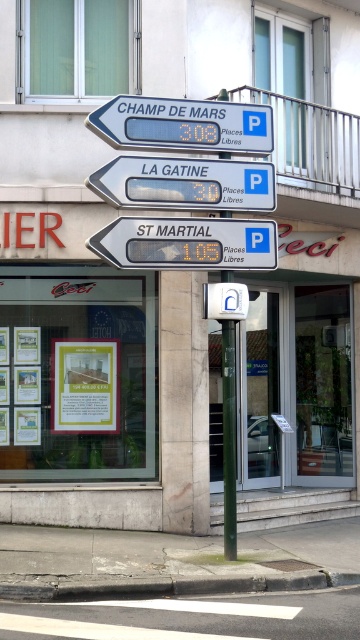
Question: Which of the following is the farthest from the observer?

Choices:
 (A) green metallic pole at center
 (B) matte gray sign at center

Answer: (A)

Question: Which is nearer to the blue plastic sign at upper center?

Choices:
 (A) matte gray sign at center
 (B) yellow paper at center
 (C) matte white sign at center
 (D) green metallic pole at center

Answer: (C)

Question: Which point is closer to the camera taking this photo?

Choices:
 (A) (267, 124)
 (B) (227, 422)
 (C) (96, 237)

Answer: (C)

Question: Does matte gray sign at center have a smaller size compared to matte white sign at center?

Choices:
 (A) no
 (B) yes

Answer: (A)

Question: Does blue plastic sign at upper center appear under matte white sign at center?

Choices:
 (A) no
 (B) yes

Answer: (A)

Question: Is matte gray sign at center closer to the viewer compared to blue plastic sign at upper center?

Choices:
 (A) yes
 (B) no

Answer: (B)